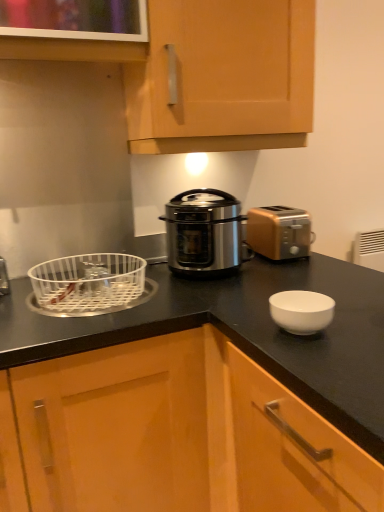
The image size is (384, 512). What do you see at coordinates (279, 232) in the screenshot?
I see `gold metallic toaster at right` at bounding box center [279, 232].

Measure the distance between white plastic basket at left and camera.

1.15 meters.

The image size is (384, 512). What do you see at coordinates (88, 283) in the screenshot?
I see `white plastic basket at left` at bounding box center [88, 283].

The height and width of the screenshot is (512, 384). Find the location of `wooden cabinet at center, which ranks as the 2th cabinetry in top-to-bottom order`. wooden cabinet at center, which ranks as the 2th cabinetry in top-to-bottom order is located at coordinates (175, 435).

In order to face wooden cabinet at center, which ranks as the 2th cabinetry in top-to-bottom order, should I rotate leftwards or rightwards?

A 14.264 degree turn to the right will do.

Identify the location of gold metallic toaster at right. (279, 232).

Looking at this image, considering the sizes of objects white plastic basket at left and wooden cabinet at center, arranged as the 1th cabinetry when ordered from the bottom, in the image provided, who is wider, white plastic basket at left or wooden cabinet at center, arranged as the 1th cabinetry when ordered from the bottom,?

wooden cabinet at center, arranged as the 1th cabinetry when ordered from the bottom, is wider.

Considering the sizes of white plastic basket at left and wooden cabinet at center, arranged as the 1th cabinetry when ordered from the bottom, in the image, is white plastic basket at left taller or shorter than wooden cabinet at center, arranged as the 1th cabinetry when ordered from the bottom,?

white plastic basket at left is shorter than wooden cabinet at center, arranged as the 1th cabinetry when ordered from the bottom.

How many degrees apart are the facing directions of white plastic basket at left and wooden cabinet at center, which ranks as the 2th cabinetry in top-to-bottom order?

90.5 degrees.

The image size is (384, 512). I want to click on kitchen appliance above the wooden cabinet at center, which ranks as the 2th cabinetry in top-to-bottom order (from the image's perspective), so click(88, 283).

Would you say gold metallic toaster at right is a long distance from stainless steel pressure cooker at center?

No, gold metallic toaster at right is not far from stainless steel pressure cooker at center.

Can you confirm if gold metallic toaster at right is shorter than stainless steel pressure cooker at center?

Correct, gold metallic toaster at right is not as tall as stainless steel pressure cooker at center.

From the image's perspective, is gold metallic toaster at right on stainless steel pressure cooker at center?

Correct, gold metallic toaster at right appears higher than stainless steel pressure cooker at center in the image.

Can you confirm if stainless steel pressure cooker at center is positioned to the left of white plastic basket at left?

In fact, stainless steel pressure cooker at center is to the right of white plastic basket at left.

Looking at this image, how distant is stainless steel pressure cooker at center from white plastic basket at left?

They are 27.41 centimeters apart.

Looking at this image, does stainless steel pressure cooker at center have a larger size compared to white plastic basket at left?

Indeed, stainless steel pressure cooker at center has a larger size compared to white plastic basket at left.

From a real-world perspective, does stainless steel pressure cooker at center stand above white plastic basket at left?

Yes, from a real-world perspective, stainless steel pressure cooker at center is over white plastic basket at left

Can you tell me how much stainless steel pressure cooker at center and gold metallic toaster at right differ in facing direction?

24.2 degrees separate the facing orientations of stainless steel pressure cooker at center and gold metallic toaster at right.

Is stainless steel pressure cooker at center next to gold metallic toaster at right and touching it?

No, stainless steel pressure cooker at center is not touching gold metallic toaster at right.

Is stainless steel pressure cooker at center turned away from gold metallic toaster at right?

No, gold metallic toaster at right is not at the back of stainless steel pressure cooker at center.

How distant is stainless steel pressure cooker at center from gold metallic toaster at right?

stainless steel pressure cooker at center is 8.41 inches from gold metallic toaster at right.

Is stainless steel pressure cooker at center inside wooden cabinet at center, which ranks as the 2th cabinetry in top-to-bottom order?

No.

How different are the orientations of wooden cabinet at center, arranged as the 1th cabinetry when ordered from the bottom, and stainless steel pressure cooker at center in degrees?

wooden cabinet at center, arranged as the 1th cabinetry when ordered from the bottom, and stainless steel pressure cooker at center are facing 59.9 degrees away from each other.

Considering the relative sizes of wooden cabinet at center, arranged as the 1th cabinetry when ordered from the bottom, and stainless steel pressure cooker at center in the image provided, is wooden cabinet at center, arranged as the 1th cabinetry when ordered from the bottom, taller than stainless steel pressure cooker at center?

Correct, wooden cabinet at center, arranged as the 1th cabinetry when ordered from the bottom, is much taller as stainless steel pressure cooker at center.

Can you confirm if wooden cabinet at center, which ranks as the 2th cabinetry in top-to-bottom order, is smaller than stainless steel pressure cooker at center?

No.

Which object is further away from the camera taking this photo, wooden cabinet at center, arranged as the 1th cabinetry when ordered from the bottom, or gold metallic toaster at right?

gold metallic toaster at right is more distant.

From the image's perspective, between wooden cabinet at center, arranged as the 1th cabinetry when ordered from the bottom, and gold metallic toaster at right, who is located below?

wooden cabinet at center, arranged as the 1th cabinetry when ordered from the bottom, is shown below in the image.

Does wooden cabinet at center, arranged as the 1th cabinetry when ordered from the bottom, have a greater width compared to gold metallic toaster at right?

Correct, the width of wooden cabinet at center, arranged as the 1th cabinetry when ordered from the bottom, exceeds that of gold metallic toaster at right.

In order to click on toaster on the right side of light wood cabinet at upper center, which is the 1th cabinetry from top to bottom in this screenshot , I will do `click(279, 232)`.

Is light wood cabinet at upper center, positioned as the second cabinetry in bottom-to-top order, at the right side of gold metallic toaster at right?

In fact, light wood cabinet at upper center, positioned as the second cabinetry in bottom-to-top order, is to the left of gold metallic toaster at right.

Is light wood cabinet at upper center, which is the 1th cabinetry from top to bottom, positioned with its back to gold metallic toaster at right?

light wood cabinet at upper center, which is the 1th cabinetry from top to bottom, does not have its back to gold metallic toaster at right.

In terms of width, does light wood cabinet at upper center, positioned as the second cabinetry in bottom-to-top order, look wider or thinner when compared to gold metallic toaster at right?

Clearly, light wood cabinet at upper center, positioned as the second cabinetry in bottom-to-top order, has more width compared to gold metallic toaster at right.

Image resolution: width=384 pixels, height=512 pixels. What are the coordinates of `kitchen appliance that is on the left side of wooden cabinet at center, which ranks as the 2th cabinetry in top-to-bottom order` in the screenshot? It's located at [x=88, y=283].

The width and height of the screenshot is (384, 512). Identify the location of toaster behind the stainless steel pressure cooker at center. (279, 232).

Based on their spatial positions, is wooden cabinet at center, which ranks as the 2th cabinetry in top-to-bottom order, or gold metallic toaster at right further from white plastic basket at left?

gold metallic toaster at right is positioned further to the anchor white plastic basket at left.

Based on the photo, based on their spatial positions, is gold metallic toaster at right or light wood cabinet at upper center, which is the 1th cabinetry from top to bottom, further from white plastic basket at left?

gold metallic toaster at right lies further to white plastic basket at left than the other object.

Estimate the real-world distances between objects in this image. Which object is closer to light wood cabinet at upper center, positioned as the second cabinetry in bottom-to-top order, gold metallic toaster at right or stainless steel pressure cooker at center?

Based on the image, stainless steel pressure cooker at center appears to be nearer to light wood cabinet at upper center, positioned as the second cabinetry in bottom-to-top order.

Based on their spatial positions, is white plastic basket at left or stainless steel pressure cooker at center closer to wooden cabinet at center, arranged as the 1th cabinetry when ordered from the bottom?

The object closer to wooden cabinet at center, arranged as the 1th cabinetry when ordered from the bottom, is white plastic basket at left.

Looking at the image, which one is located closer to white plastic basket at left, wooden cabinet at center, arranged as the 1th cabinetry when ordered from the bottom, or light wood cabinet at upper center, which is the 1th cabinetry from top to bottom?

Among the two, wooden cabinet at center, arranged as the 1th cabinetry when ordered from the bottom, is located nearer to white plastic basket at left.

Considering their positions, is stainless steel pressure cooker at center positioned further to white plastic basket at left than gold metallic toaster at right?

gold metallic toaster at right is further to white plastic basket at left.

Considering their positions, is light wood cabinet at upper center, positioned as the second cabinetry in bottom-to-top order, positioned closer to wooden cabinet at center, which ranks as the 2th cabinetry in top-to-bottom order, than white plastic basket at left?

The object closer to wooden cabinet at center, which ranks as the 2th cabinetry in top-to-bottom order, is white plastic basket at left.

Looking at the image, which one is located closer to light wood cabinet at upper center, positioned as the second cabinetry in bottom-to-top order, stainless steel pressure cooker at center or gold metallic toaster at right?

Based on the image, stainless steel pressure cooker at center appears to be nearer to light wood cabinet at upper center, positioned as the second cabinetry in bottom-to-top order.

Locate an element on the screen. home appliance between light wood cabinet at upper center, positioned as the second cabinetry in bottom-to-top order, and wooden cabinet at center, arranged as the 1th cabinetry when ordered from the bottom, in the vertical direction is located at coordinates (205, 233).

Locate an element on the screen. The height and width of the screenshot is (512, 384). toaster between light wood cabinet at upper center, positioned as the second cabinetry in bottom-to-top order, and wooden cabinet at center, which ranks as the 2th cabinetry in top-to-bottom order, vertically is located at coordinates (279, 232).

Locate an element on the screen. kitchen appliance between wooden cabinet at center, arranged as the 1th cabinetry when ordered from the bottom, and gold metallic toaster at right from front to back is located at coordinates (88, 283).

I want to click on toaster between light wood cabinet at upper center, positioned as the second cabinetry in bottom-to-top order, and white plastic basket at left, in the vertical direction, so click(279, 232).